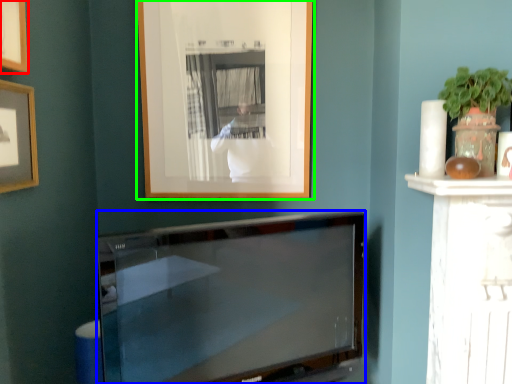
Question: Which is nearer to the picture frame (highlighted by a red box)? television (highlighted by a blue box) or picture frame (highlighted by a green box).

Choices:
 (A) television
 (B) picture frame

Answer: (B)